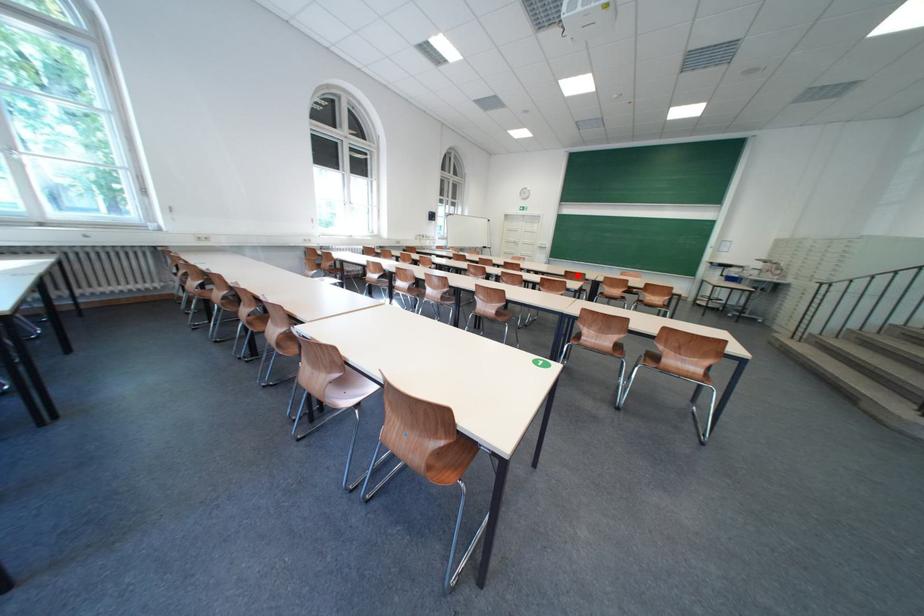
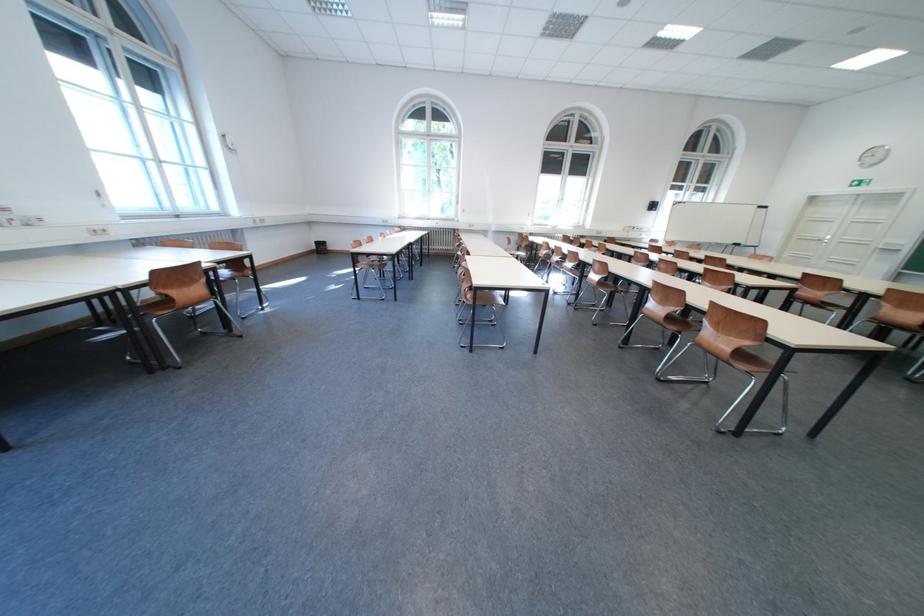
Where in the second image is the point corresponding to the highlighted location from the first image?

(813, 278)